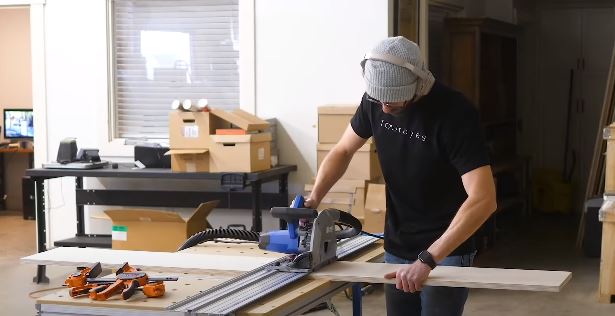
Locate an element on the screen. boxes is located at coordinates (247, 151).